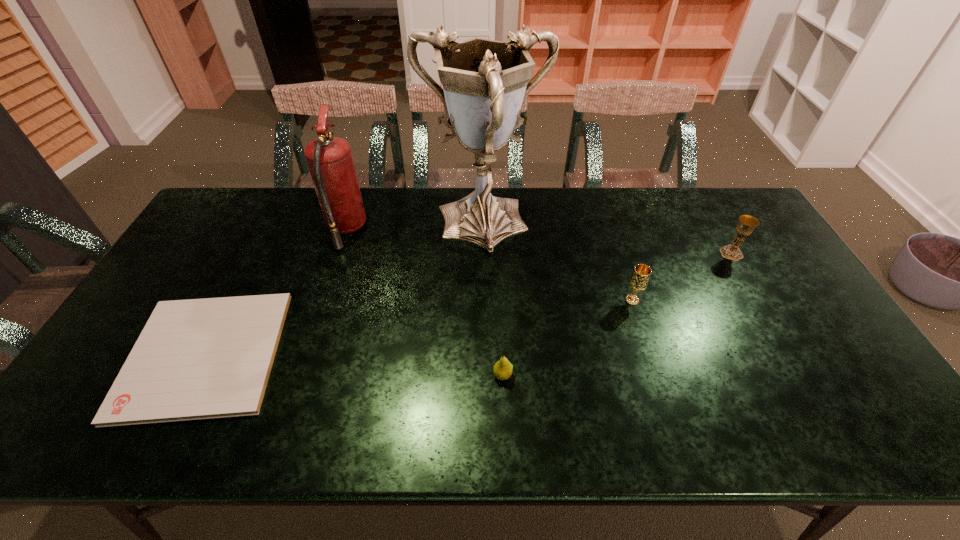
The height and width of the screenshot is (540, 960). Find the location of `vacant space at the far edge of the desktop`. vacant space at the far edge of the desktop is located at coordinates (400, 199).

Locate an element on the screen. vacant space at the near edge is located at coordinates (258, 429).

Image resolution: width=960 pixels, height=540 pixels. What are the coordinates of `vacant area at the left edge` in the screenshot? It's located at (89, 387).

Find the location of a particular element. The image size is (960, 540). free space at the right edge of the desktop is located at coordinates (776, 280).

Locate an element on the screen. The height and width of the screenshot is (540, 960). vacant area at the far left corner of the desktop is located at coordinates (263, 192).

Where is `blank region between the second shortest object and the fifth shortest object`? blank region between the second shortest object and the fifth shortest object is located at coordinates (424, 302).

Locate an element on the screen. The width and height of the screenshot is (960, 540). empty location between the nearer chalice and the farther chalice is located at coordinates (682, 276).

Where is `free space that is in between the shortest object and the second tallest object`? This screenshot has height=540, width=960. free space that is in between the shortest object and the second tallest object is located at coordinates (276, 292).

Identify the location of free spot between the fifth object from left to right and the clipboard. The height and width of the screenshot is (540, 960). (419, 327).

Identify the location of free space between the fifth shortest object and the pear. (424, 302).